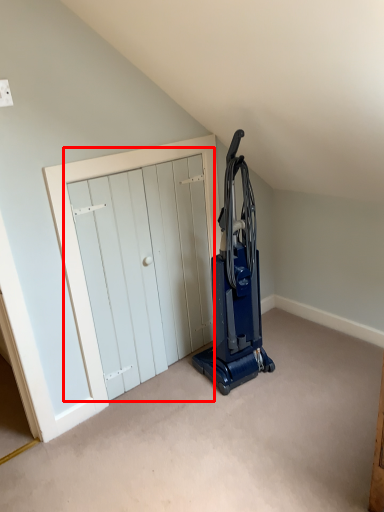
Question: From the image's perspective, what is the correct spatial relationship of door (annotated by the red box) in relation to home appliance?

Choices:
 (A) below
 (B) above

Answer: (A)